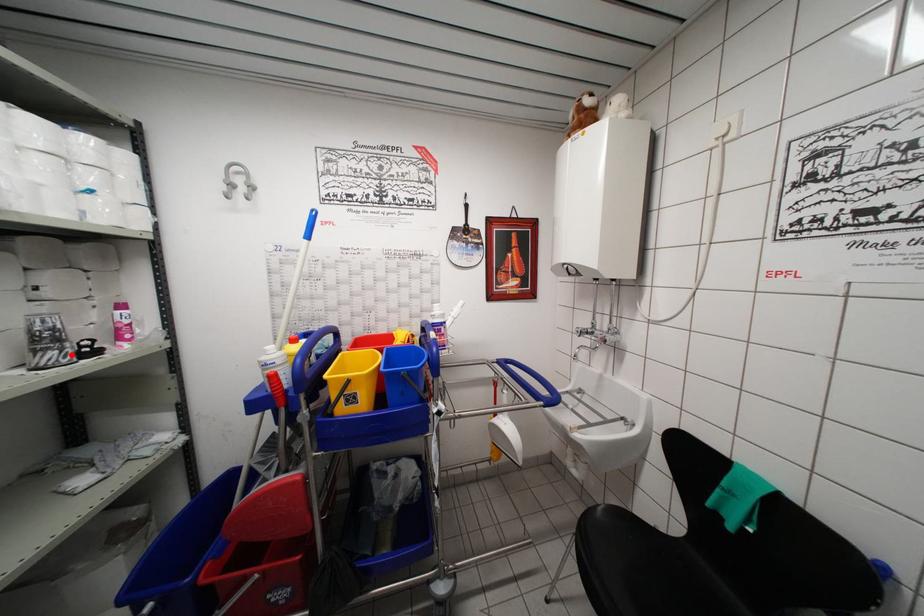
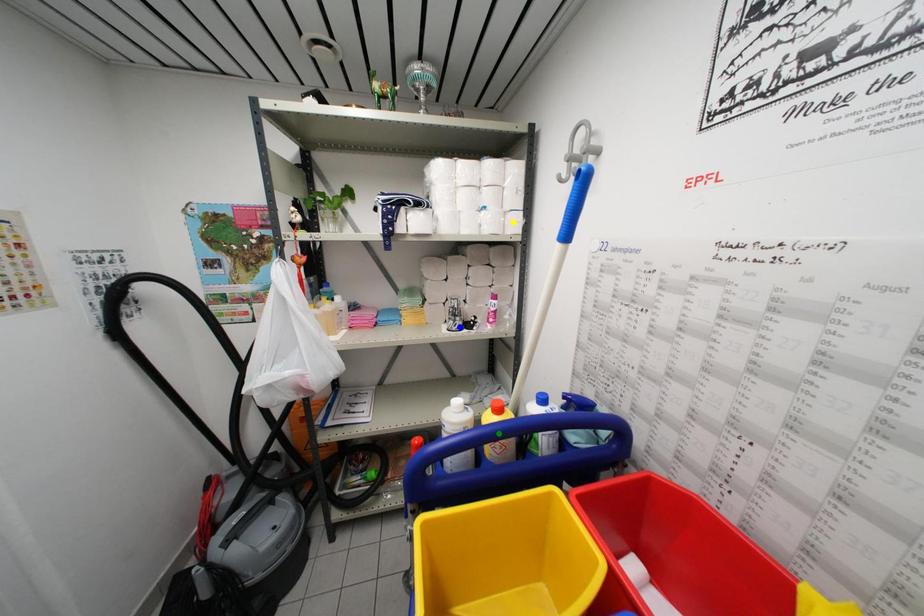
Question: I am providing you with two images of the same scene from different viewpoints. A red point is marked on the first image. You are given multiple points on the second image. Which point in image 2 is actually the same real-world point as the red point in image 1?

Choices:
 (A) green point
 (B) yellow point
 (C) blue point

Answer: (C)